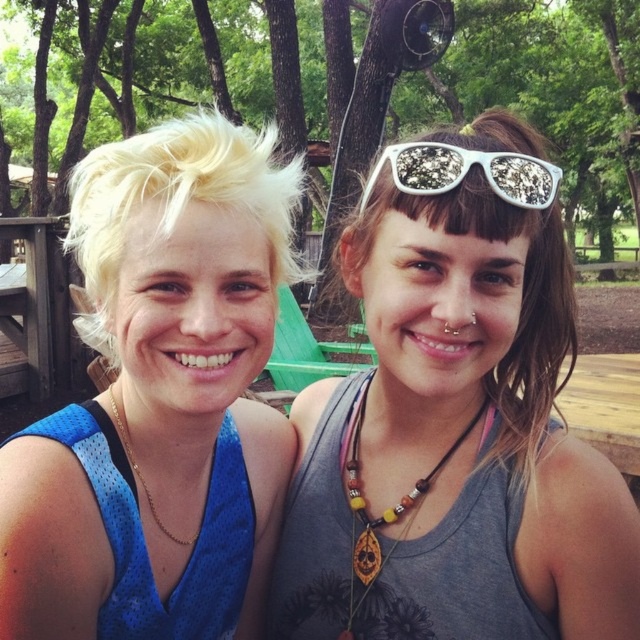
Who is taller, wooden picnic table at left or wooden bead necklace at center?

wooden picnic table at left

Does point (38, 365) come behind point (380, 522)?

That is True.

The image size is (640, 640). I want to click on wooden picnic table at left, so click(35, 307).

Which is below, gray fabric tank top at center or blonde hair at left?

Positioned lower is gray fabric tank top at center.

Is gray fabric tank top at center below blonde hair at left?

Correct, gray fabric tank top at center is located below blonde hair at left.

Who is more distant from viewer, (524, 324) or (92, 488)?

The point (524, 324) is behind.

Identify the location of gray fabric tank top at center. (454, 420).

Is white glittery sunglasses at upper center thinner than wooden bead necklace at center?

In fact, white glittery sunglasses at upper center might be wider than wooden bead necklace at center.

Which of these two, white glittery sunglasses at upper center or wooden bead necklace at center, stands shorter?

With less height is white glittery sunglasses at upper center.

Image resolution: width=640 pixels, height=640 pixels. Identify the location of white glittery sunglasses at upper center. (465, 172).